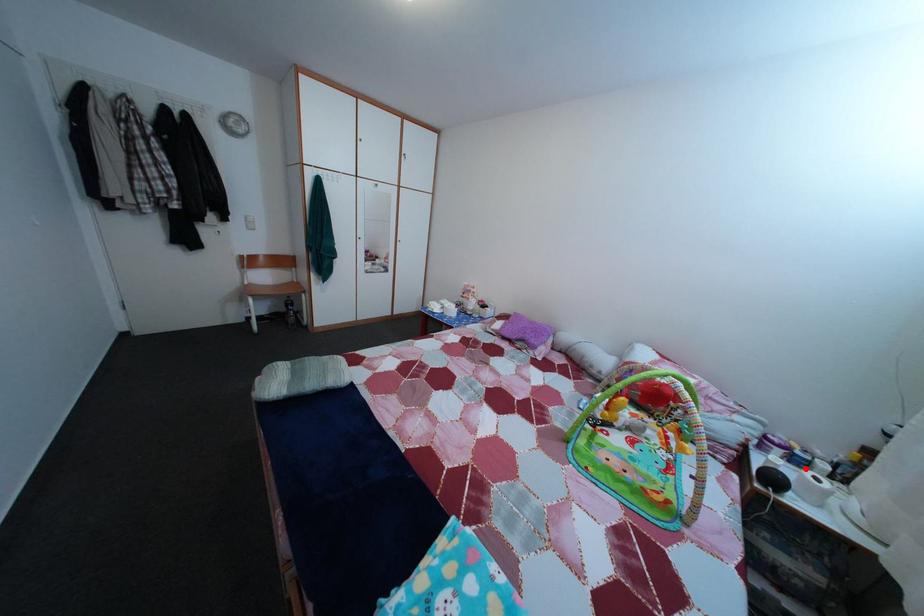
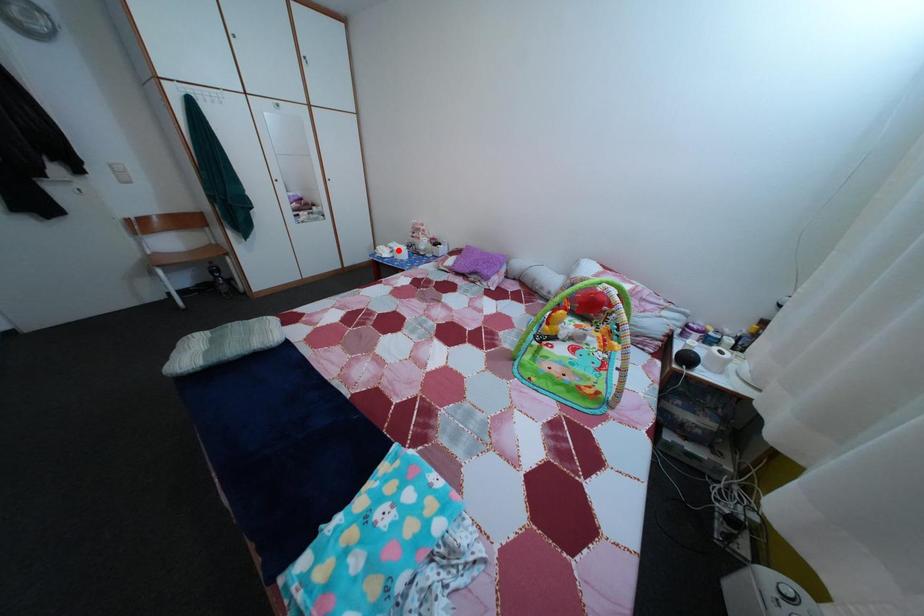
I am providing you with two images of the same scene from different viewpoints. A red point is marked on the first image and another point is marked on the second image. Does the point marked in image1 correspond to the same location as the one in image2?

No